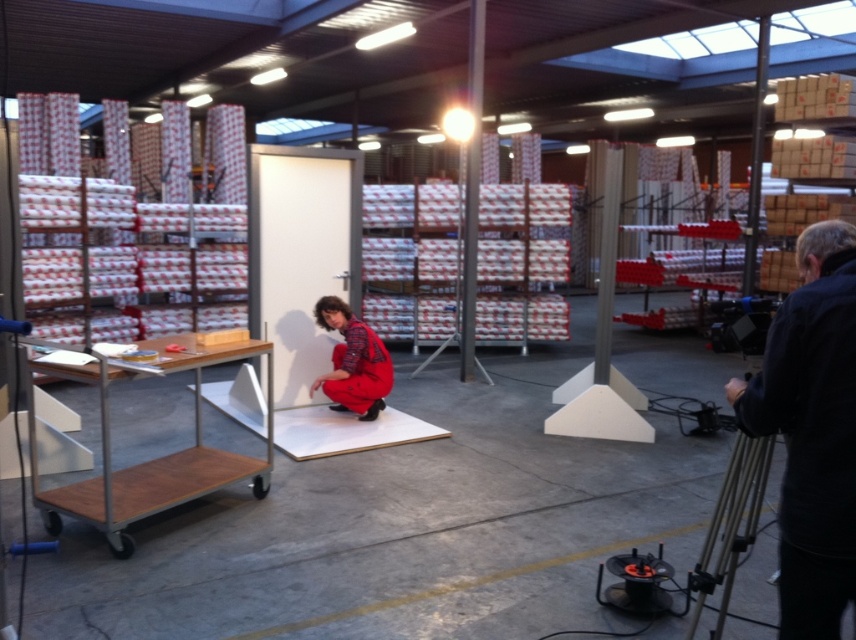
Question: Can you confirm if brown wooden trolley at left is wider than red plaid jumpsuit at center?

Choices:
 (A) no
 (B) yes

Answer: (B)

Question: Which point is farther to the camera?

Choices:
 (A) (207, 460)
 (B) (797, 323)
 (C) (360, 401)

Answer: (C)

Question: Which of these objects is positioned closest to the brown wooden trolley at left?

Choices:
 (A) red plaid jumpsuit at center
 (B) black fabric at right

Answer: (A)

Question: Where is brown wooden trolley at left located in relation to red plaid jumpsuit at center in the image?

Choices:
 (A) above
 (B) below

Answer: (B)

Question: Which of the following is the farthest from the observer?

Choices:
 (A) (173, 467)
 (B) (841, 358)
 (C) (366, 346)

Answer: (C)

Question: Observing the image, what is the correct spatial positioning of brown wooden trolley at left in reference to red plaid jumpsuit at center?

Choices:
 (A) right
 (B) left

Answer: (B)